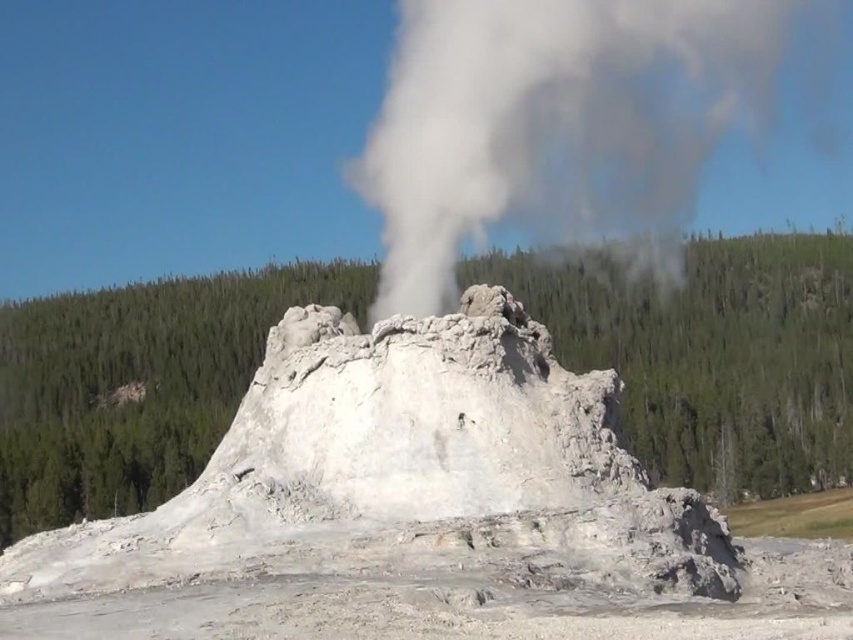
Question: Can you confirm if white rocky geyser at center is smaller than white vapor at center?

Choices:
 (A) no
 (B) yes

Answer: (B)

Question: Is white rocky geyser at center wider than white vapor at center?

Choices:
 (A) no
 (B) yes

Answer: (A)

Question: Which point is farther from the camera taking this photo?

Choices:
 (A) (679, 576)
 (B) (404, 227)

Answer: (B)

Question: Among these points, which one is farthest from the camera?

Choices:
 (A) (305, 449)
 (B) (718, 115)

Answer: (B)

Question: Can you confirm if white rocky geyser at center is thinner than white vapor at center?

Choices:
 (A) no
 (B) yes

Answer: (B)